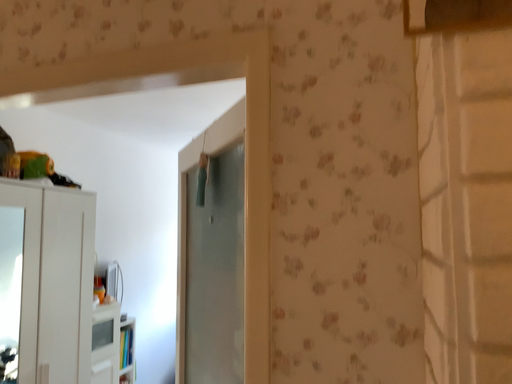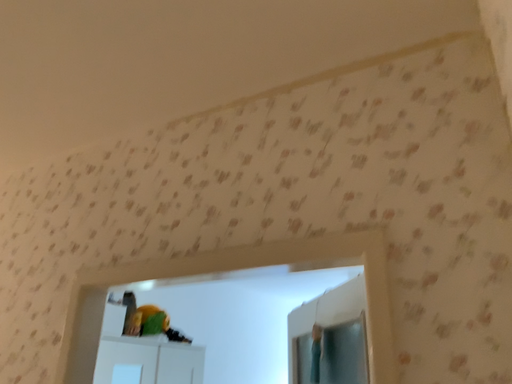
Question: How did the camera likely rotate when shooting the video?

Choices:
 (A) rotated left
 (B) rotated right

Answer: (A)